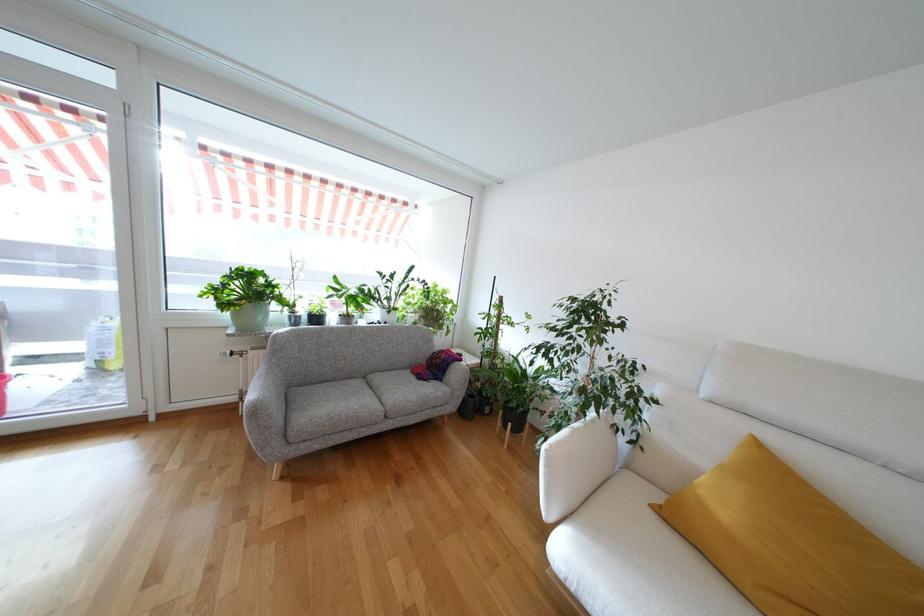
Where would you lift the green plant pot? Please return your answer as a coordinate pair (x, y).

(245, 296)